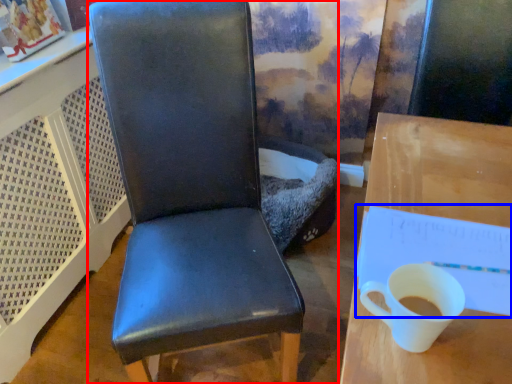
Question: Which point is further to the camera, chair (highlighted by a red box) or notepad (highlighted by a blue box)?

Choices:
 (A) chair
 (B) notepad

Answer: (B)